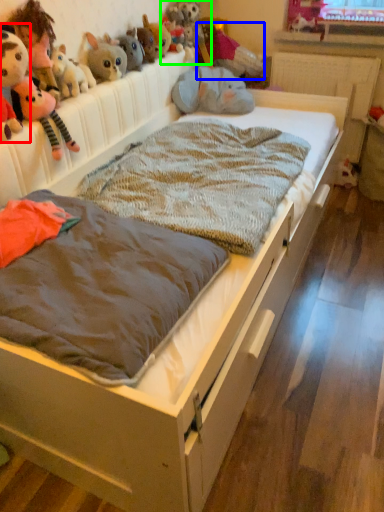
Question: Considering the real-world distances, which object is closest to toy (highlighted by a red box)? toy (highlighted by a blue box) or toy (highlighted by a green box).

Choices:
 (A) toy
 (B) toy

Answer: (B)